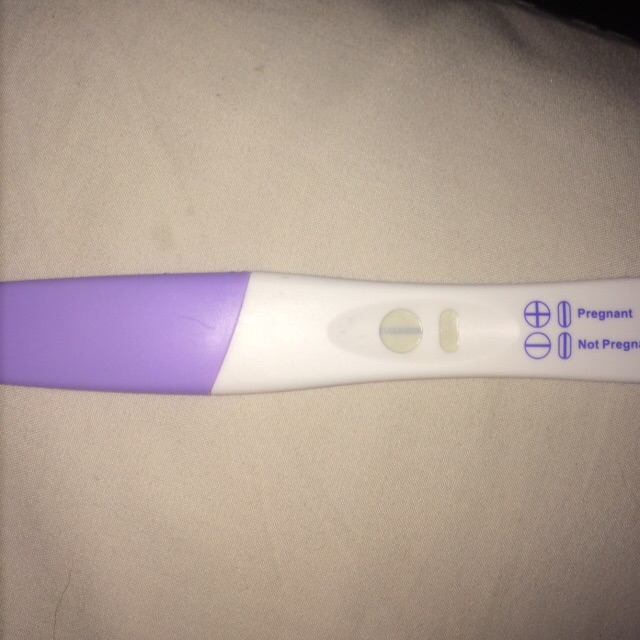
This screenshot has width=640, height=640. What are the coordinates of `countertop above pregnancy test` in the screenshot? It's located at (324, 102).